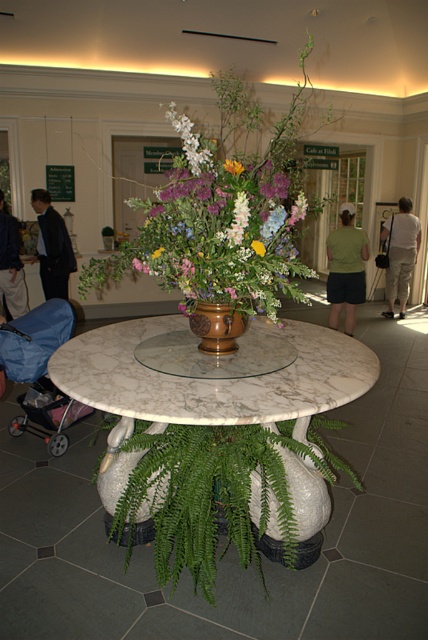
In the scene shown: You are a photographer standing at the edge of the room, wanting to capture both the green fabric dress at center and the light beige pants at center in a single frame. Your camera has a maximum focus range of 1.5 meters. Can you include both subjects in your photo without moving your position?

The green fabric dress at center is 1.44 meters away from the light beige pants at center. Since the distance between them is within the camera maximum focus range of 1.5 meters, the photographer can include both subjects in the photo without moving.

You are a photographer planning to capture a closeup shot of the white matte flowers at center. You need to ensure that the dark blue suit at center does not block the flowers in your frame. Based on the scene description, can you determine if the flowers will be fully visible without obstruction from the suit?

The dark blue suit at center is wider than the white matte flowers at center. Since the suit is wider, it may block part of the flowers depending on their positioning. To ensure visibility, adjust the angle or position to avoid overlap.

You are an event planner arranging a photo shoot in this space. You need to ensure that the dark blue suit at center and the white matte flowers at center are visible in the shot. Given their heights, which object will appear taller in the photo?

The dark blue suit at center has a greater height compared to the white matte flowers at center, so it will appear taller in the photo.